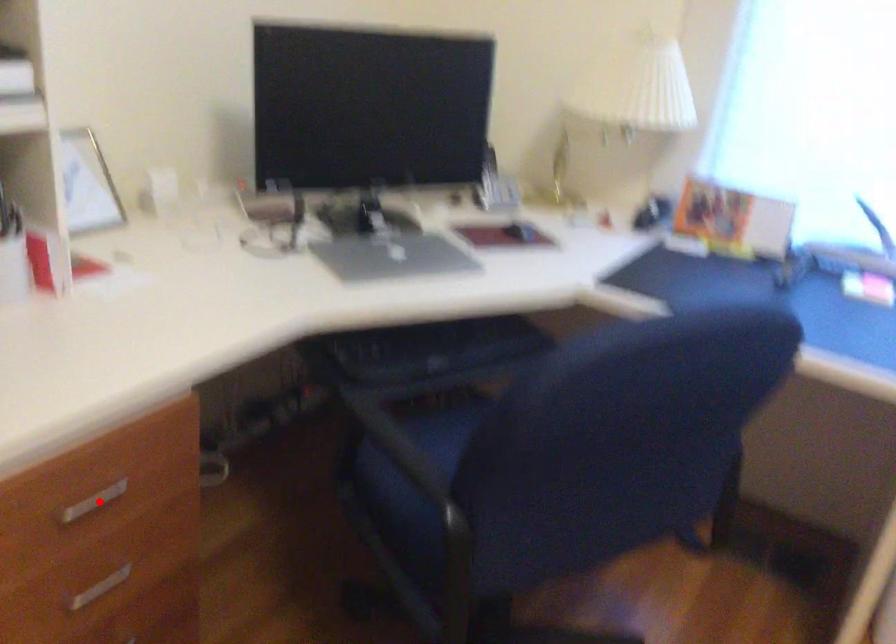
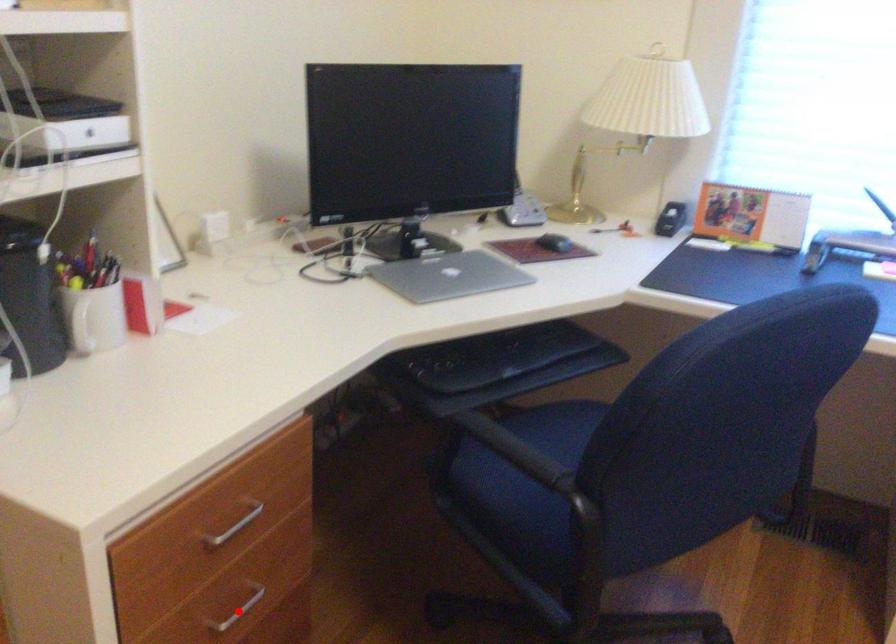
I am providing you with two images of the same scene from different viewpoints. A red point is marked on the first image and another point is marked on the second image. Are the points marked in image1 and image2 representing the same 3D position?

No